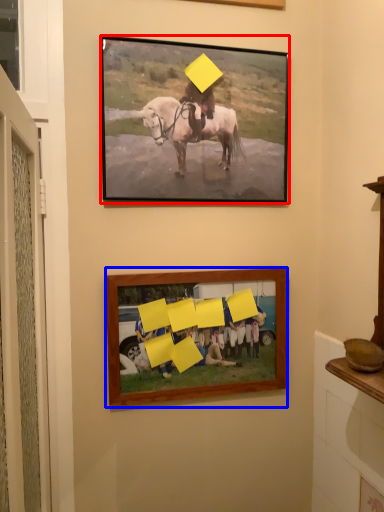
Question: Among these objects, which one is farthest to the camera, picture frame (highlighted by a red box) or picture frame (highlighted by a blue box)?

Choices:
 (A) picture frame
 (B) picture frame

Answer: (B)